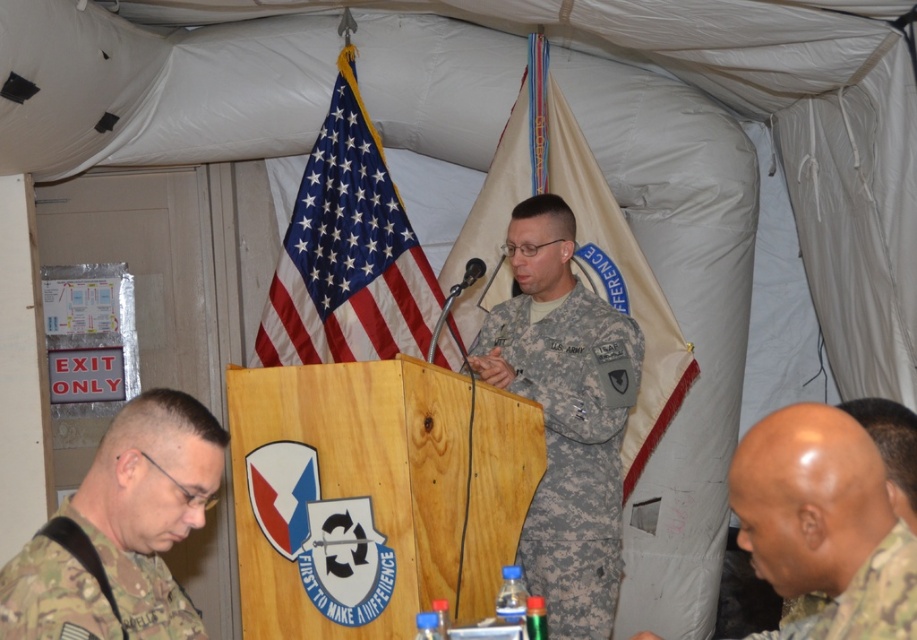
Question: Is camouflage fabric uniform at center to the right of camouflage uniform at lower right from the viewer's perspective?

Choices:
 (A) yes
 (B) no

Answer: (B)

Question: Estimate the real-world distances between objects in this image. Which object is closer to the camouflage uniform at lower right?

Choices:
 (A) american flag at center
 (B) camouflage fabric uniform at lower left

Answer: (B)

Question: Is camouflage uniform at lower right above american flag at center?

Choices:
 (A) no
 (B) yes

Answer: (A)

Question: Which point appears farthest from the camera in this image?

Choices:
 (A) (840, 637)
 (B) (556, 109)
 (C) (895, 582)

Answer: (B)

Question: Observing the image, what is the correct spatial positioning of camouflage uniform at lower right in reference to camouflage fabric uniform at lower right?

Choices:
 (A) above
 (B) below

Answer: (A)

Question: Considering the real-world distances, which object is farthest from the blue satin flag at upper center?

Choices:
 (A) camouflage uniform at lower right
 (B) american flag at center
 (C) camouflage fabric uniform at lower left

Answer: (A)